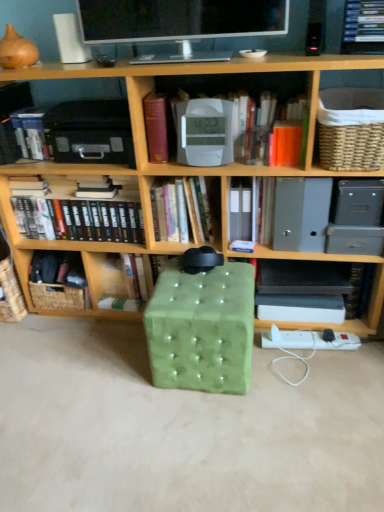
Question: Is green velvet ottoman at center bigger than hardcover book at center, which ranks as the 3th book in left-to-right order?

Choices:
 (A) yes
 (B) no

Answer: (A)

Question: Is green velvet ottoman at center oriented away from hardcover book at center, which ranks as the 3th book in left-to-right order?

Choices:
 (A) yes
 (B) no

Answer: (B)

Question: Is green velvet ottoman at center placed right next to hardcover book at center, which is the 4th book from right to left?

Choices:
 (A) yes
 (B) no

Answer: (B)

Question: Is green velvet ottoman at center at the right side of hardcover book at center, which ranks as the 3th book in left-to-right order?

Choices:
 (A) yes
 (B) no

Answer: (A)

Question: From the image's perspective, is green velvet ottoman at center beneath hardcover book at center, which is the 4th book from right to left?

Choices:
 (A) no
 (B) yes

Answer: (B)

Question: Is matte black monitor at upper center situated inside woven brown basket at lower left, the second basket in the right-to-left sequence, or outside?

Choices:
 (A) outside
 (B) inside

Answer: (A)

Question: Would you say matte black monitor at upper center is to the left or to the right of woven brown basket at lower left, which ranks as the second basket in top-to-bottom order, in the picture?

Choices:
 (A) left
 (B) right

Answer: (B)

Question: From their relative heights in the image, would you say matte black monitor at upper center is taller or shorter than woven brown basket at lower left, which ranks as the second basket in top-to-bottom order?

Choices:
 (A) tall
 (B) short

Answer: (A)

Question: Looking at the image, does matte black monitor at upper center seem bigger or smaller compared to woven brown basket at lower left, positioned as the 1th basket in back-to-front order?

Choices:
 (A) big
 (B) small

Answer: (A)

Question: Relative to matte black monitor at upper center, is hardcover books at center, positioned as the fifth book in right-to-left order, in front or behind?

Choices:
 (A) front
 (B) behind

Answer: (B)

Question: Considering the positions of hardcover books at center, positioned as the fifth book in right-to-left order, and matte black monitor at upper center in the image, is hardcover books at center, positioned as the fifth book in right-to-left order, wider or thinner than matte black monitor at upper center?

Choices:
 (A) wide
 (B) thin

Answer: (B)

Question: Does point (34, 222) appear closer or farther from the camera than point (231, 19)?

Choices:
 (A) closer
 (B) farther

Answer: (B)

Question: From the image's perspective, is hardcover books at center, positioned as the fifth book in right-to-left order, positioned above or below matte black monitor at upper center?

Choices:
 (A) above
 (B) below

Answer: (B)

Question: In terms of width, does woven brown basket at lower left, which is the second basket in front-to-back order, look wider or thinner when compared to hardcover book at left, arranged as the 6th book when viewed from the right?

Choices:
 (A) wide
 (B) thin

Answer: (A)

Question: From a real-world perspective, is woven brown basket at lower left, the second basket in the right-to-left sequence, above or below hardcover book at left, which is the 1th book in left-to-right order?

Choices:
 (A) below
 (B) above

Answer: (A)